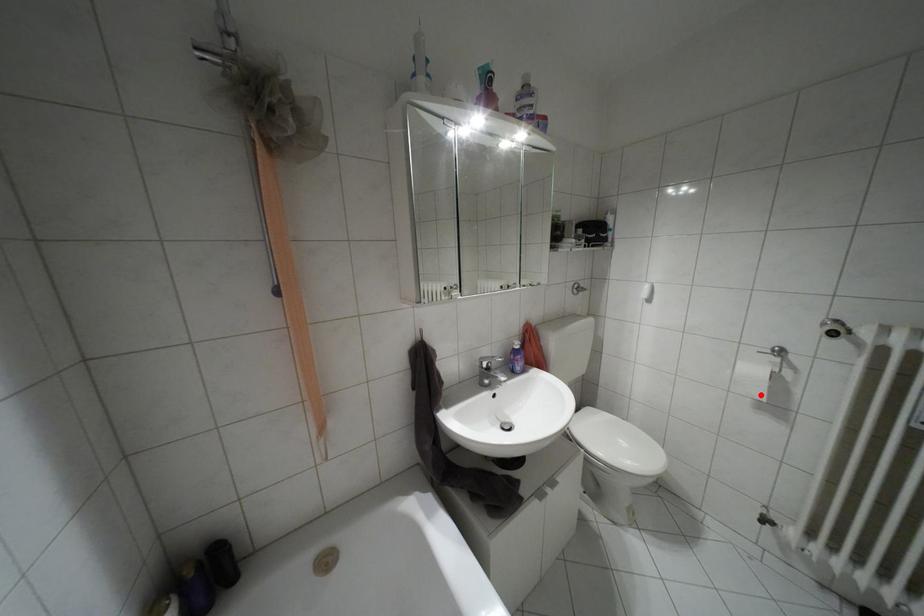
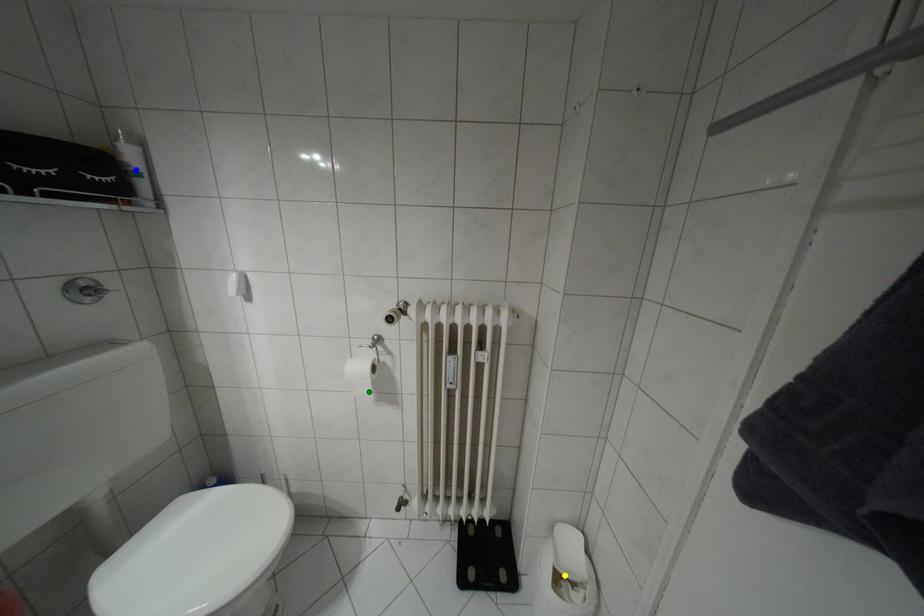
Question: I am providing you with two images of the same scene from different viewpoints. A red point is marked on the first image. You are given multiple points on the second image. Which mark in image 2 goes with the point in image 1?

Choices:
 (A) blue point
 (B) green point
 (C) yellow point

Answer: (B)